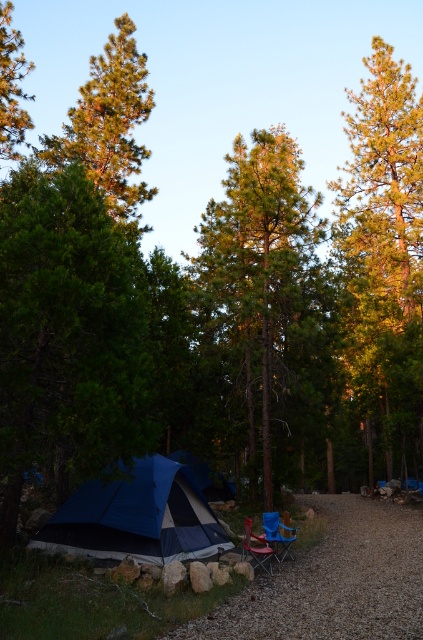
Question: Which point appears farthest from the camera in this image?

Choices:
 (A) (131, 214)
 (B) (280, 556)

Answer: (A)

Question: Is green textured pine tree at upper left above green pine tree at left?

Choices:
 (A) no
 (B) yes

Answer: (B)

Question: Can you confirm if green textured pine tree at right is bigger than blue fabric tent at lower left?

Choices:
 (A) yes
 (B) no

Answer: (A)

Question: Estimate the real-world distances between objects in this image. Which object is closer to the green textured pine tree at right?

Choices:
 (A) blue fabric chair at lower right
 (B) green textured pine tree at center
 (C) green pine tree at left
 (D) green textured pine tree at upper left

Answer: (B)

Question: Among these objects, which one is nearest to the camera?

Choices:
 (A) green pine tree at left
 (B) green textured pine tree at center

Answer: (B)

Question: Can you confirm if blue fabric tent at lower left is wider than green pine tree at left?

Choices:
 (A) no
 (B) yes

Answer: (A)